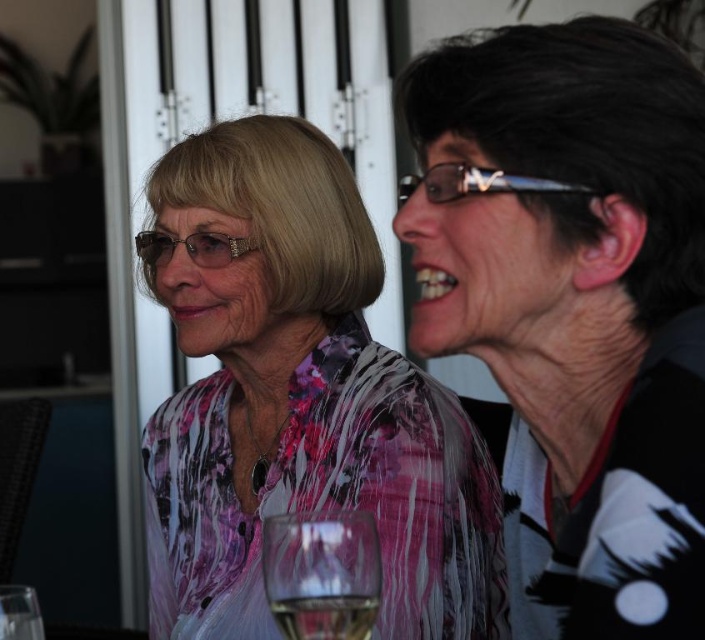
Question: Which of the following is the farthest from the observer?

Choices:
 (A) clear plastic glasses at upper center
 (B) transparent glass at lower center
 (C) clear plastic glasses at center

Answer: (C)

Question: Which point is closer to the camera?

Choices:
 (A) black glossy hair at upper right
 (B) transparent glass at lower center

Answer: (A)

Question: Among these points, which one is nearest to the camera?

Choices:
 (A) (352, 595)
 (B) (441, 177)
 (C) (355, 568)

Answer: (A)

Question: Can you confirm if pink floral shirt at center is positioned below clear plastic glasses at center?

Choices:
 (A) no
 (B) yes

Answer: (B)

Question: Does pink floral shirt at center appear under clear plastic glasses at upper center?

Choices:
 (A) no
 (B) yes

Answer: (B)

Question: Does pink floral shirt at center appear over clear plastic glasses at center?

Choices:
 (A) no
 (B) yes

Answer: (A)